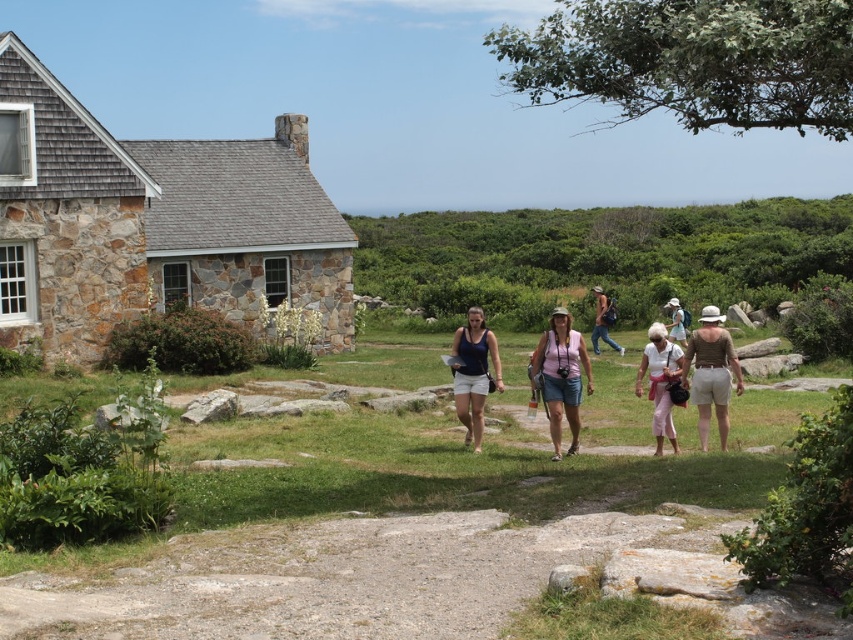
Question: Which point appears closest to the camera in this image?

Choices:
 (A) (613, 308)
 (B) (572, 424)
 (C) (706, 392)

Answer: (C)

Question: Can you confirm if stone shingles cottage at left is thinner than matte blue tank top at center?

Choices:
 (A) yes
 (B) no

Answer: (B)

Question: Considering the relative positions of brown cotton shorts at center-right and matte blue tank top at center in the image provided, where is brown cotton shorts at center-right located with respect to matte blue tank top at center?

Choices:
 (A) left
 (B) right

Answer: (B)

Question: Which point is closer to the camera?

Choices:
 (A) (548, 365)
 (B) (701, 374)
 (C) (612, 298)
 (D) (474, 390)

Answer: (B)

Question: Which object is farther from the camera taking this photo?

Choices:
 (A) pink fabric shirt at center
 (B) matte white hat at center
 (C) matte pink pants at center
 (D) matte blue jeans at center

Answer: (D)

Question: Is pink fabric shirt at center closer to camera compared to matte blue jeans at center?

Choices:
 (A) yes
 (B) no

Answer: (A)